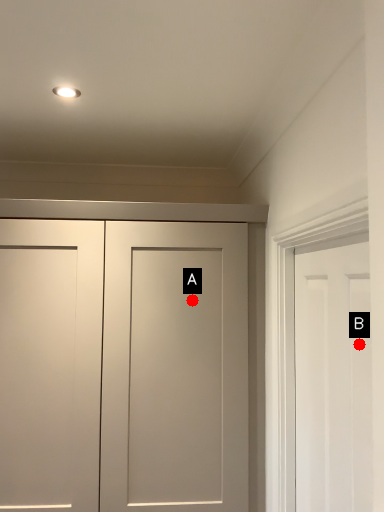
Question: Two points are circled on the image, labeled by A and B beside each circle. Which point appears closest to the camera in this image?

Choices:
 (A) A is closer
 (B) B is closer

Answer: (B)